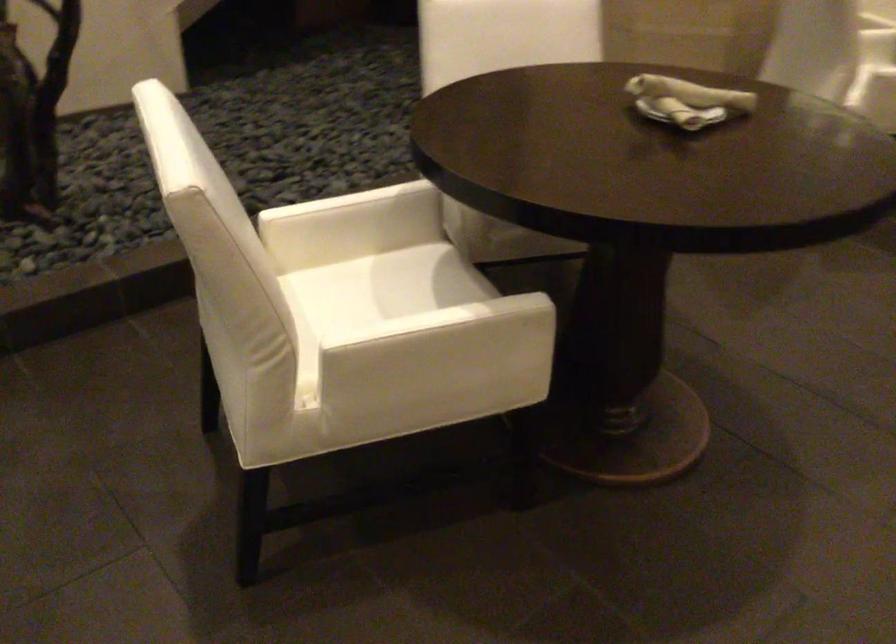
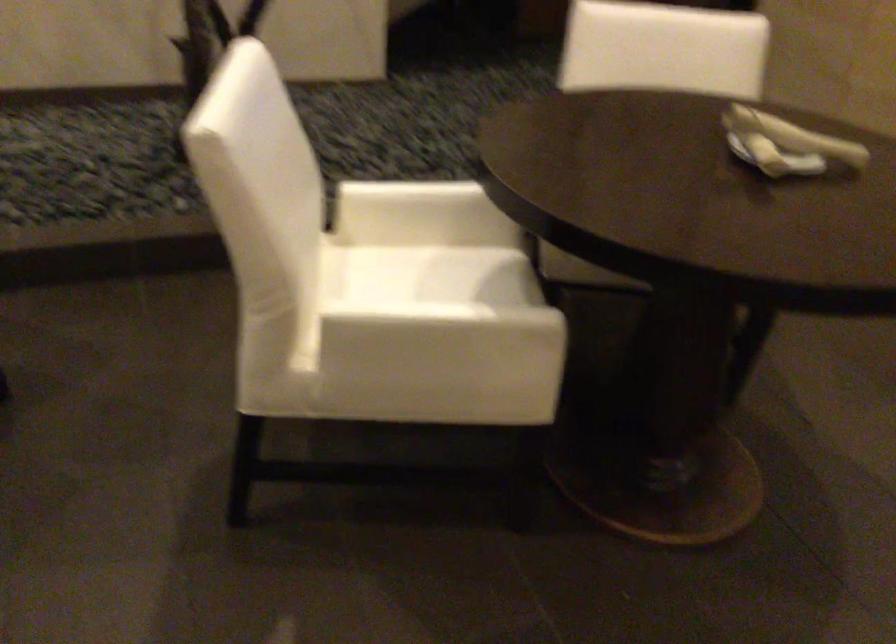
Find the pixel in the second image that matches point (343, 229) in the first image.

(418, 214)